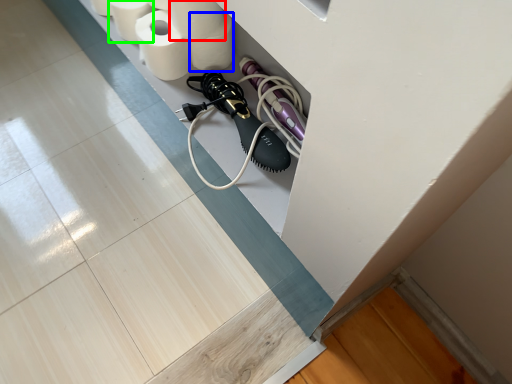
Question: Considering the real-world distances, which object is farthest from toilet paper (highlighted by a red box)? toilet paper (highlighted by a blue box) or toilet paper (highlighted by a green box)?

Choices:
 (A) toilet paper
 (B) toilet paper

Answer: (B)